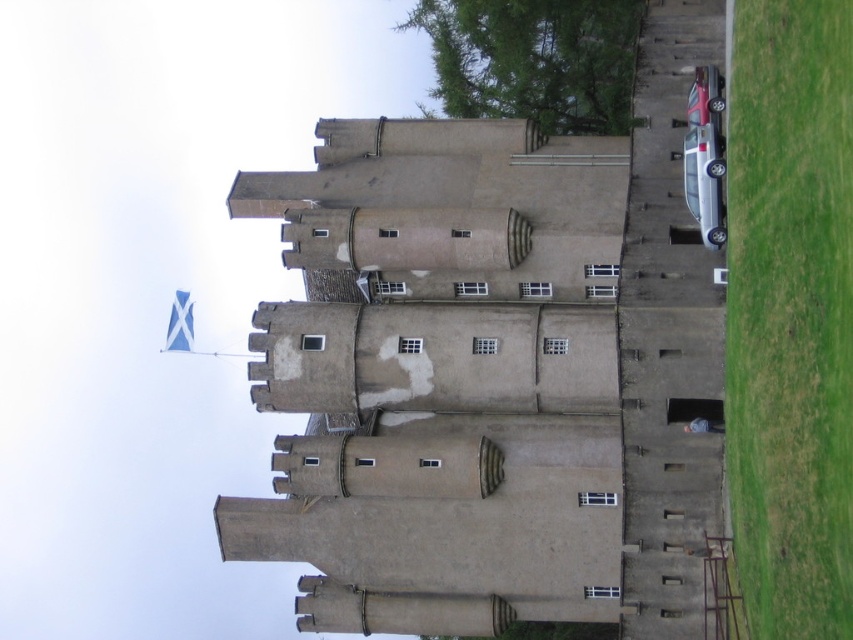
Question: Based on their relative distances, which object is farther from the silver metallic car at right?

Choices:
 (A) green grass at lower right
 (B) metallic red car at upper right

Answer: (A)

Question: Which of the following is the closest to the observer?

Choices:
 (A) (773, 566)
 (B) (703, 173)
 (C) (706, 67)

Answer: (A)

Question: Which point is farther from the camera taking this photo?

Choices:
 (A) (718, 192)
 (B) (796, 632)
 (C) (711, 100)

Answer: (C)

Question: Does silver metallic car at right have a larger size compared to metallic red car at upper right?

Choices:
 (A) no
 (B) yes

Answer: (A)

Question: In this image, where is silver metallic car at right located relative to metallic red car at upper right?

Choices:
 (A) right
 (B) left

Answer: (B)

Question: Does green grass at lower right appear on the right side of silver metallic car at right?

Choices:
 (A) yes
 (B) no

Answer: (A)